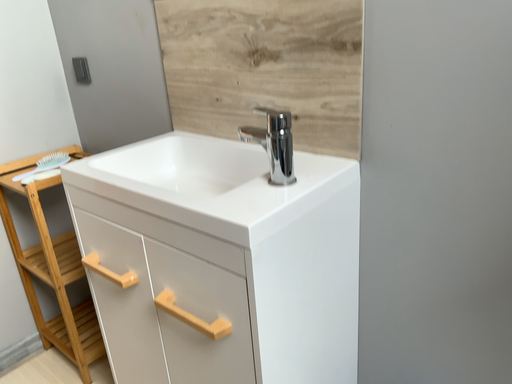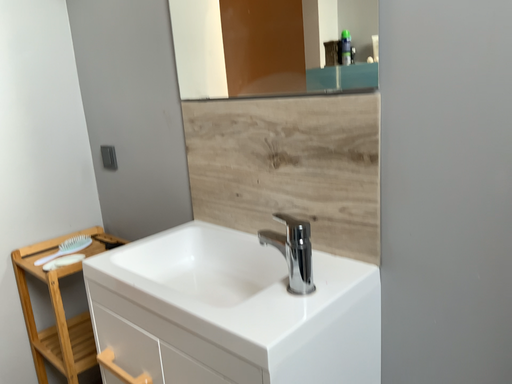
Question: How did the camera likely rotate when shooting the video?

Choices:
 (A) rotated upward
 (B) rotated downward

Answer: (A)